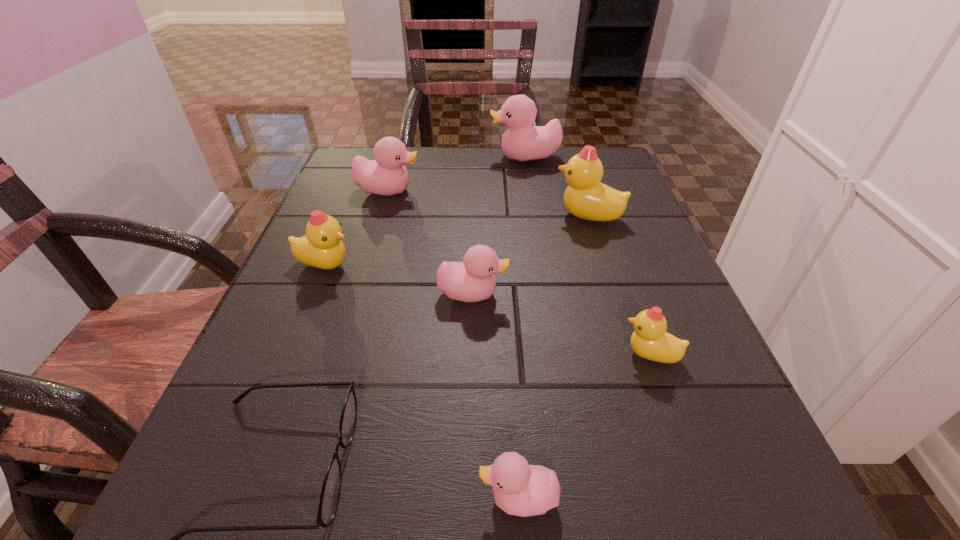
Locate an element on the screen. The height and width of the screenshot is (540, 960). the third nearest object is located at coordinates (650, 340).

Where is `the nearest yellow duckling`? Image resolution: width=960 pixels, height=540 pixels. the nearest yellow duckling is located at coordinates (650, 340).

Locate an element on the screen. the nearest pink duckling is located at coordinates (520, 489).

You are a GUI agent. You are given a task and a screenshot of the screen. Output one action in this format:
    pyautogui.click(x=<x>, y=<y>)
    Task: Click on the shortest duckling
    The width and height of the screenshot is (960, 540).
    Given the screenshot: What is the action you would take?
    pyautogui.click(x=520, y=489)

Identify the location of vacant space positioned 0.130m on the front-facing side of the farthest duckling. The height and width of the screenshot is (540, 960). (439, 158).

The width and height of the screenshot is (960, 540). In order to click on blank area located on the front-facing side of the farthest duckling in this screenshot , I will do `click(419, 158)`.

You are a GUI agent. You are given a task and a screenshot of the screen. Output one action in this format:
    pyautogui.click(x=<x>, y=<y>)
    Task: Click on the free space located on the front-facing side of the farthest duckling
    The image size is (960, 540).
    Given the screenshot: What is the action you would take?
    pyautogui.click(x=458, y=158)

Locate an element on the screen. This screenshot has height=540, width=960. vacant space positioned on the front-facing side of the biggest yellow duckling is located at coordinates (440, 216).

Locate an element on the screen. free region located 0.400m on the front-facing side of the biggest yellow duckling is located at coordinates coord(364,216).

The image size is (960, 540). What are the coordinates of `free space located on the front-facing side of the biggest yellow duckling` in the screenshot? It's located at (512, 216).